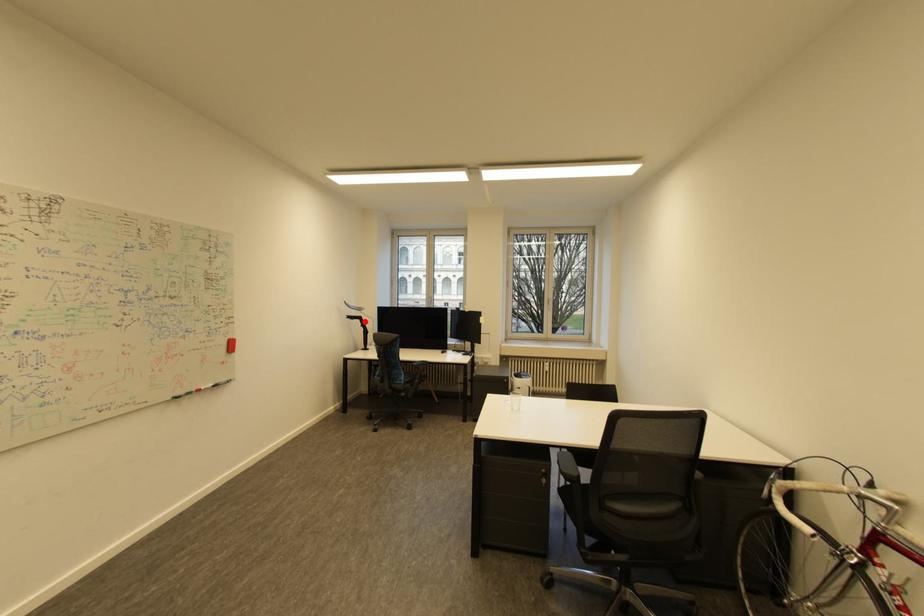
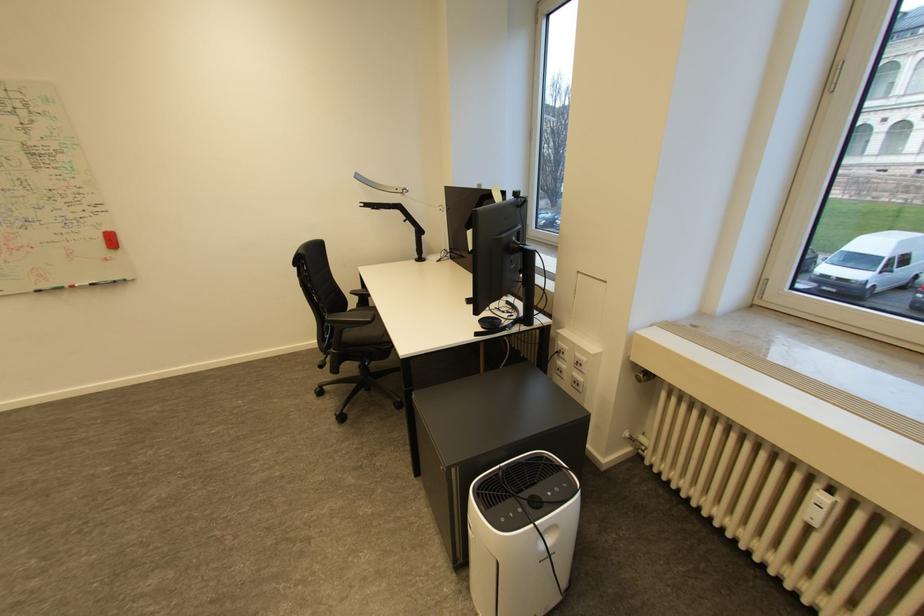
Question: A red point is marked in image1. In image2, is the corresponding 3D point closer to the camera or farther? Reply with the corresponding letter.

Choices:
 (A) The corresponding 3D point is closer.
 (B) The corresponding 3D point is farther.

Answer: (A)